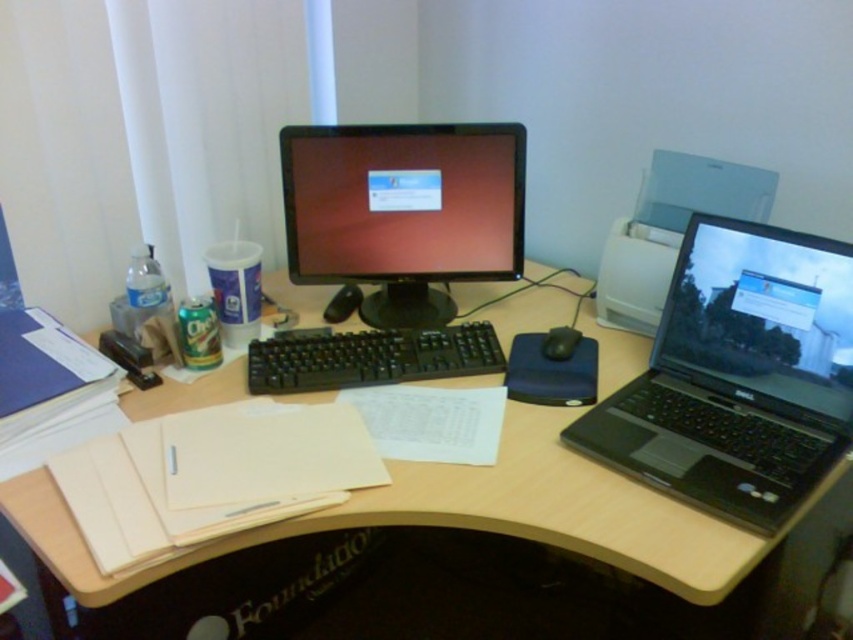
You are organizing your desk and want to place a new wireless charger between the black plastic keyboard at center and the black rubber mouse at center. Since the charger is 15 cm wide, will there be enough space between them?

The black plastic keyboard at center is larger than the black rubber mouse at center, but the exact distance between them isn

In the scene shown: You are a delivery robot that needs to deliver a package to the black plastic laptop at right. Your arm can reach 36 inches. Can you reach it from your current position?

The distance between the black plastic laptop at right and your current position is 38.68 inches. Since your arm can only reach 36 inches, you cannot reach the black plastic laptop at right.

You are standing in front of the desk and want to place a new object at the point closer to you between point (846,268) and point (560,349). Which point should you choose?

You should choose point (846,268) because it is closer to you than point (560,349).